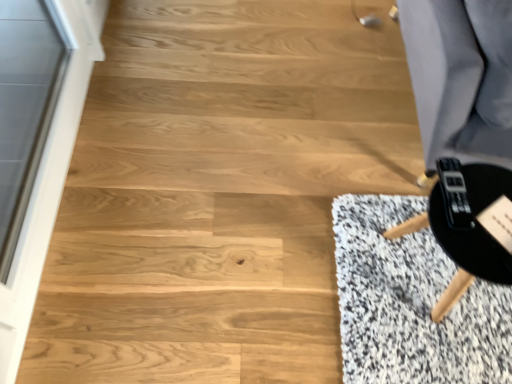
Question: From a real-world perspective, is black matte round table at lower right located beneath transparent glass screen door at left?

Choices:
 (A) no
 (B) yes

Answer: (B)

Question: Is black matte round table at lower right not close to transparent glass screen door at left?

Choices:
 (A) no
 (B) yes

Answer: (B)

Question: Is black matte round table at lower right oriented towards transparent glass screen door at left?

Choices:
 (A) no
 (B) yes

Answer: (A)

Question: From the image's perspective, is black matte round table at lower right on transparent glass screen door at left?

Choices:
 (A) no
 (B) yes

Answer: (A)

Question: Considering the relative sizes of black matte round table at lower right and transparent glass screen door at left in the image provided, is black matte round table at lower right wider than transparent glass screen door at left?

Choices:
 (A) no
 (B) yes

Answer: (B)

Question: Is black matte round table at lower right to the left of transparent glass screen door at left from the viewer's perspective?

Choices:
 (A) yes
 (B) no

Answer: (B)

Question: Does black matte round table at lower right have a lesser height compared to black matte game controller at lower right?

Choices:
 (A) yes
 (B) no

Answer: (B)

Question: Does black matte round table at lower right lie behind black matte game controller at lower right?

Choices:
 (A) no
 (B) yes

Answer: (A)

Question: From the image's perspective, is black matte round table at lower right on black matte game controller at lower right?

Choices:
 (A) no
 (B) yes

Answer: (A)

Question: Can you confirm if black matte round table at lower right is taller than black matte game controller at lower right?

Choices:
 (A) no
 (B) yes

Answer: (B)

Question: Is black matte game controller at lower right at the back of black matte round table at lower right?

Choices:
 (A) yes
 (B) no

Answer: (B)

Question: Is black matte round table at lower right closer to the viewer compared to black matte game controller at lower right?

Choices:
 (A) no
 (B) yes

Answer: (B)

Question: Can you confirm if transparent glass screen door at left is taller than black matte round table at lower right?

Choices:
 (A) yes
 (B) no

Answer: (A)